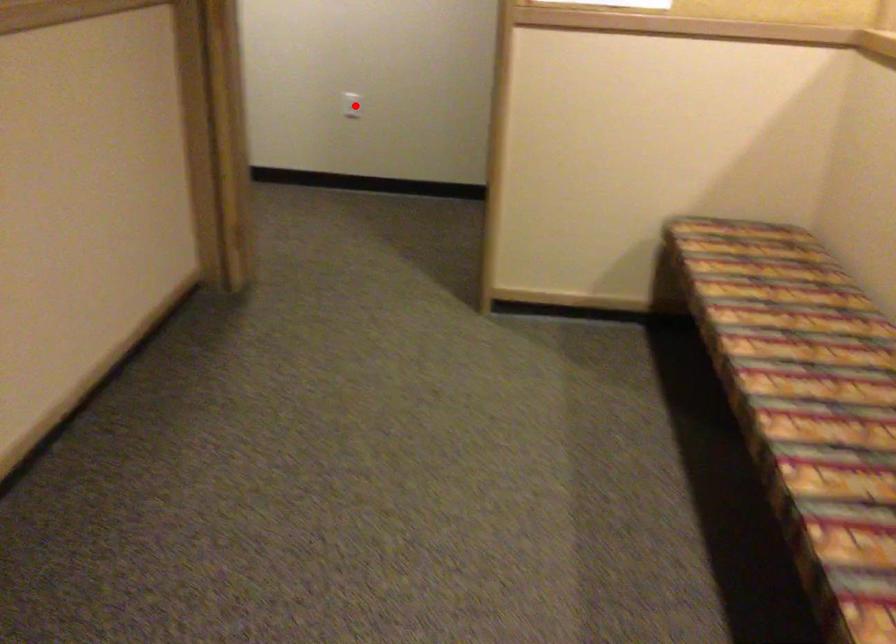
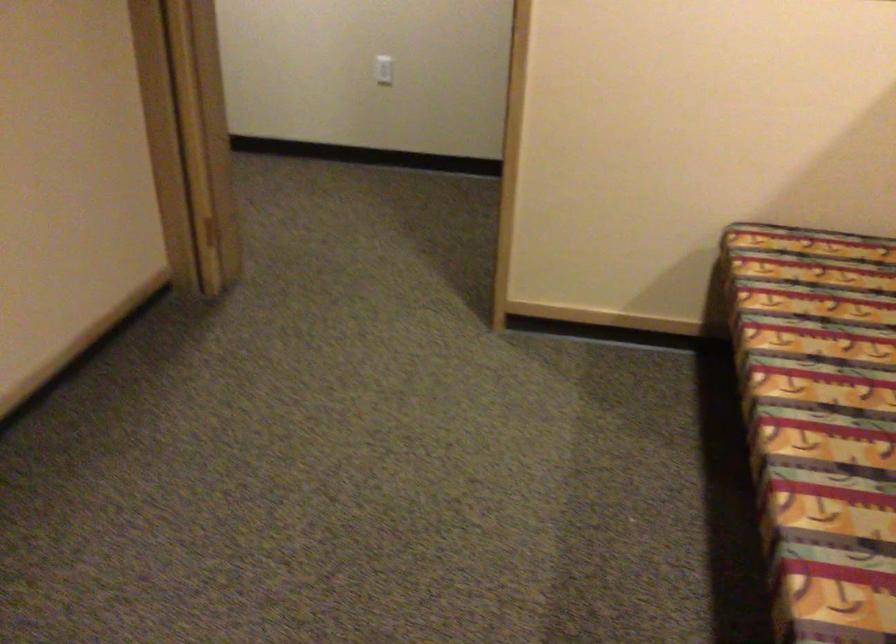
In the second image, find the point that corresponds to the highlighted location in the first image.

(383, 70)